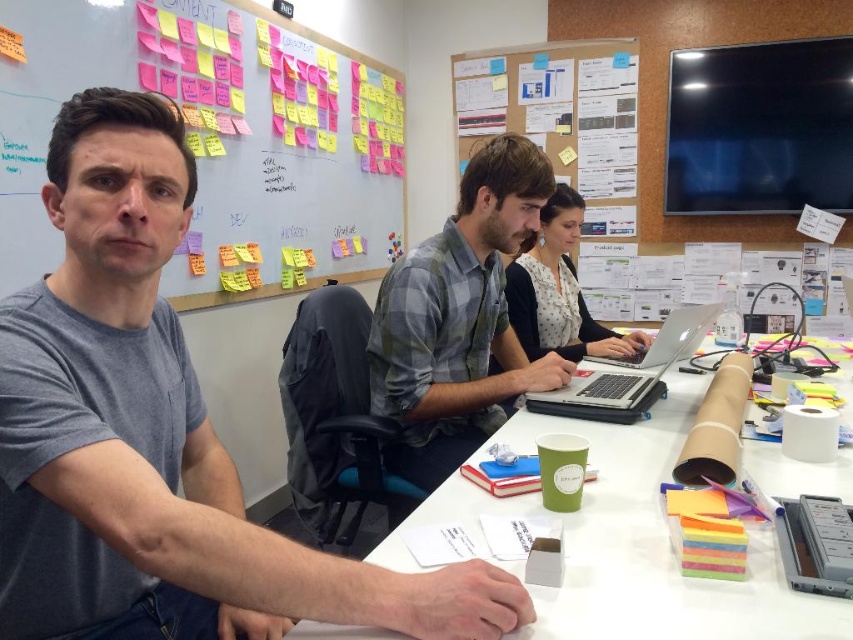
Question: Which object is positioned farthest from the white paper at center?

Choices:
 (A) silver metallic laptop at center
 (B) multicolored sticky notes at upper left

Answer: (B)

Question: Can you confirm if multicolored sticky notes at upper left is positioned to the left of silver metallic laptop at center?

Choices:
 (A) no
 (B) yes

Answer: (B)

Question: Can you confirm if gray cotton t-shirt at left is thinner than plaid shirt at center?

Choices:
 (A) yes
 (B) no

Answer: (B)

Question: Is gray cotton t-shirt at left positioned behind multicolored sticky notes at upper left?

Choices:
 (A) no
 (B) yes

Answer: (A)

Question: Which object is farther from the camera taking this photo?

Choices:
 (A) white paper at center
 (B) multicolored sticky notes at upper left
 (C) gray cotton t-shirt at left

Answer: (B)

Question: Among these objects, which one is farthest from the camera?

Choices:
 (A) white paper at center
 (B) multicolored sticky notes at upper left
 (C) plaid shirt at center

Answer: (C)